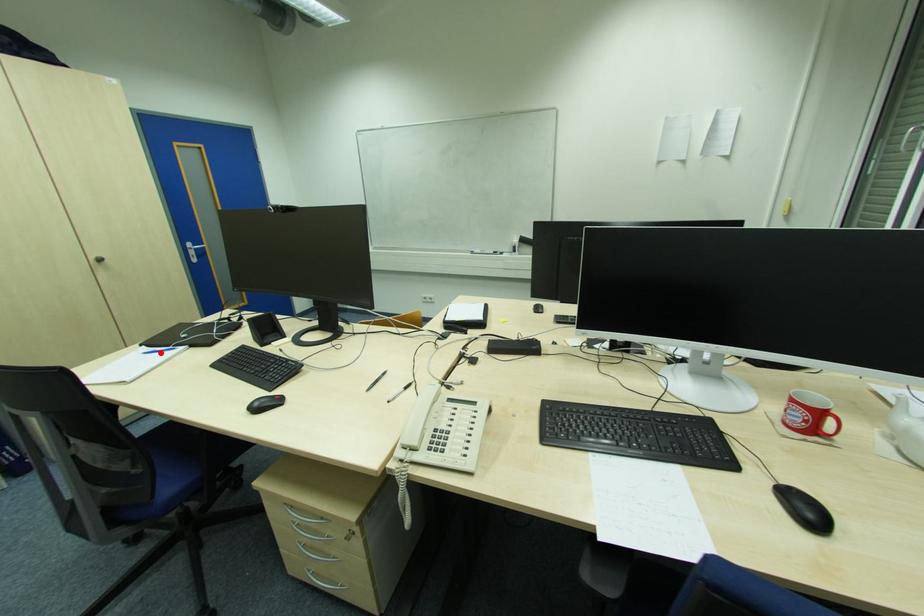
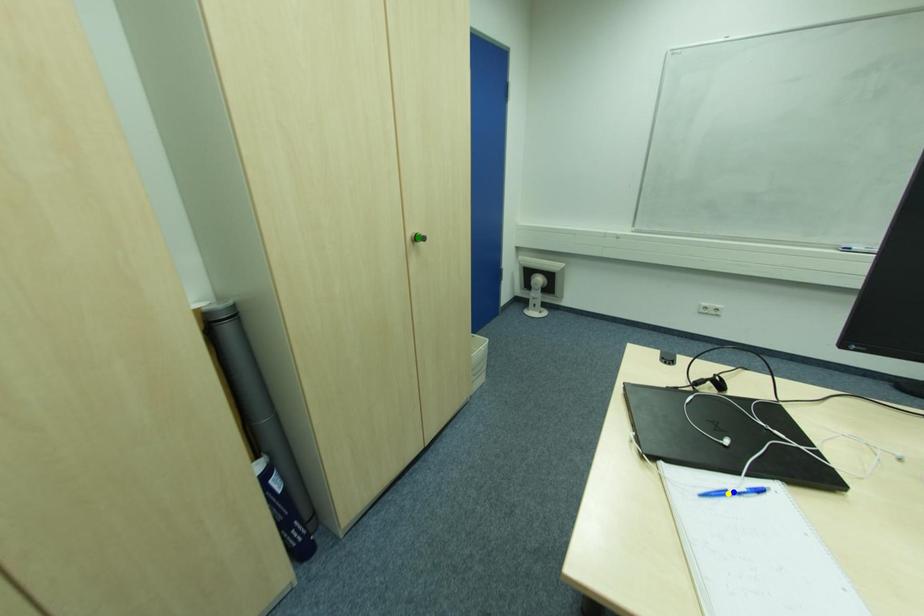
Question: I am providing you with two images of the same scene from different viewpoints. A red point is marked on the first image. You are given multiple points on the second image. In image 2, which mark is for the same physical point as the one in image 1?

Choices:
 (A) blue point
 (B) yellow point
 (C) green point

Answer: (B)